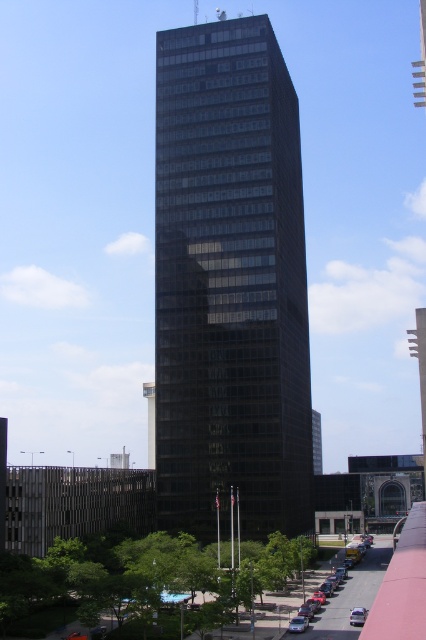
Does metallic silver sedan at lower right appear on the right side of silver metallic sedan at center?

Correct, you'll find metallic silver sedan at lower right to the right of silver metallic sedan at center.

Is point (363, 586) closer to viewer compared to point (307, 625)?

No.

Locate an element on the screen. This screenshot has height=640, width=426. metallic silver sedan at lower right is located at coordinates click(348, 600).

Can you confirm if black glass building at center is positioned to the left of silver metallic sedan at center?

Indeed, black glass building at center is positioned on the left side of silver metallic sedan at center.

Who is more distant from viewer, (224, 532) or (305, 625)?

The point (224, 532) is behind.

Locate an element on the screen. This screenshot has height=640, width=426. black glass building at center is located at coordinates (230, 284).

Is point (363, 612) more distant than point (305, 618)?

Yes, point (363, 612) is farther from viewer.

Is point (359, 612) closer to viewer compared to point (299, 627)?

No, it is behind (299, 627).

Where is `silver metallic sedan at lower right`? This screenshot has width=426, height=640. silver metallic sedan at lower right is located at coordinates (357, 616).